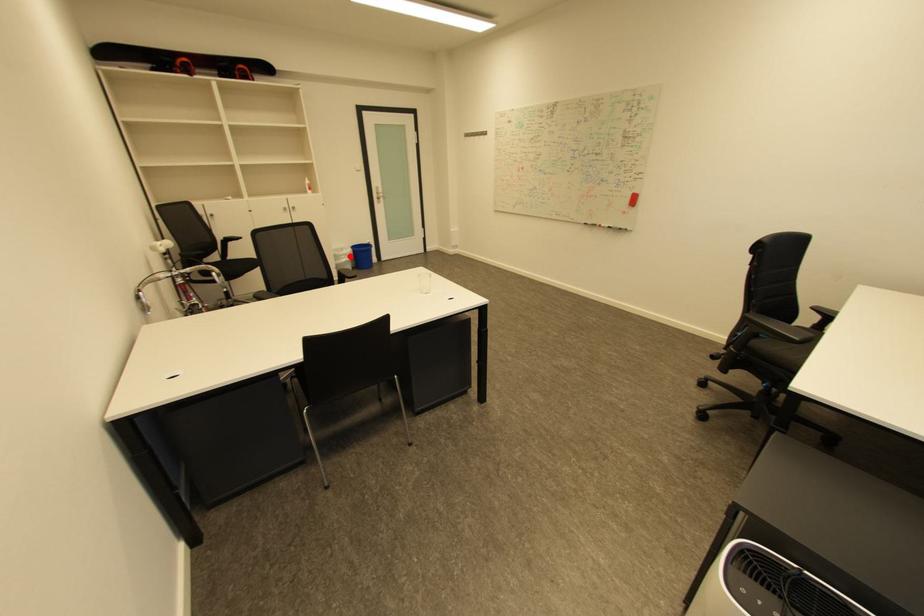
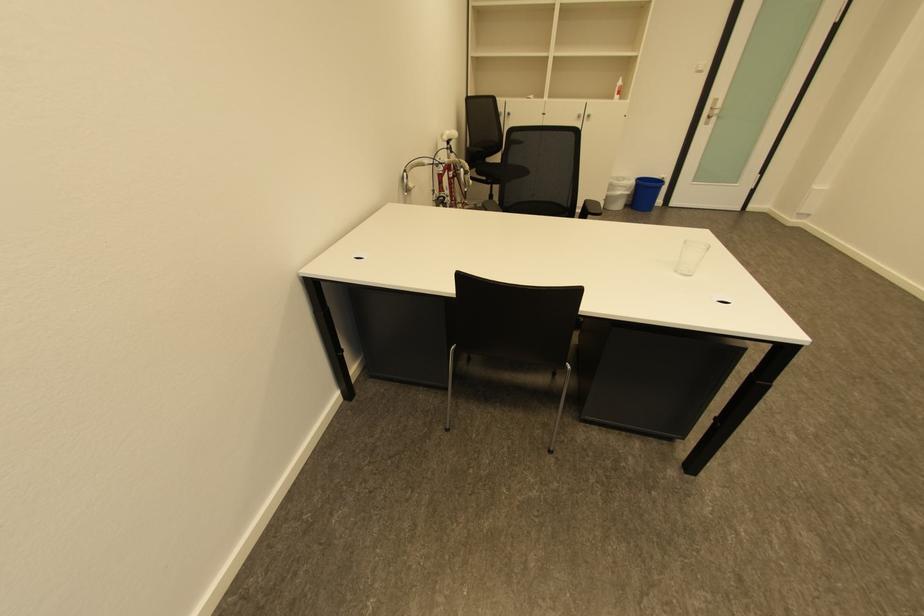
Question: I am providing you with two images of the same scene from different viewpoints. Given a red point in image1, look at the same physical point in image2. Is it:

Choices:
 (A) Closer to the viewpoint
 (B) Farther from the viewpoint

Answer: (B)